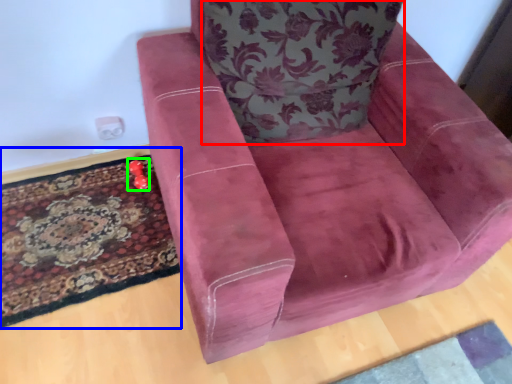
Question: Which object is positioned closest to throw pillow (highlighted by a red box)? Select from mat (highlighted by a blue box) and toy (highlighted by a green box).

Choices:
 (A) mat
 (B) toy

Answer: (A)